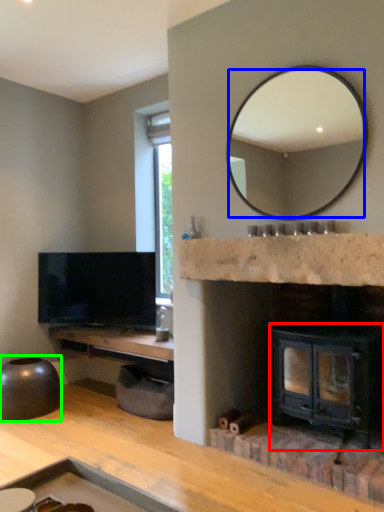
Question: Estimate the real-world distances between objects in this image. Which object is closer to wood burning stove (highlighted by a red box), mirror (highlighted by a blue box) or round table (highlighted by a green box)?

Choices:
 (A) mirror
 (B) round table

Answer: (B)